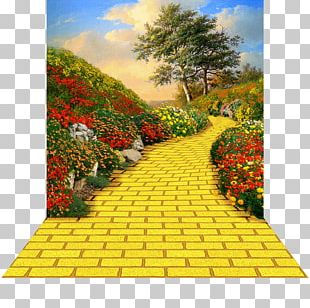
Find the location of `plant shadow`. plant shadow is located at coordinates (91, 208), (109, 182), (140, 155), (200, 131), (213, 165), (216, 185), (248, 215).